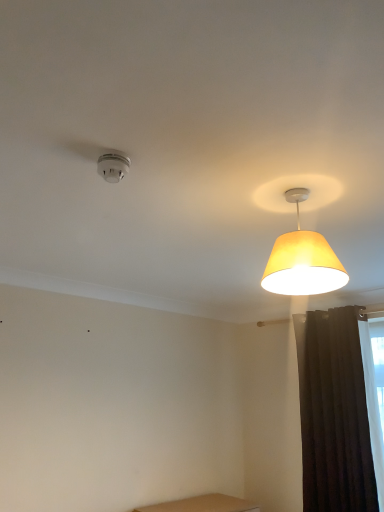
Question: In terms of height, does dark matte curtain at right look taller or shorter compared to white plastic smoke detector at upper left, the 2th lamp viewed from the right?

Choices:
 (A) short
 (B) tall

Answer: (B)

Question: From the image's perspective, is dark matte curtain at right located above or below white plastic smoke detector at upper left, the 2th lamp viewed from the right?

Choices:
 (A) above
 (B) below

Answer: (B)

Question: Estimate the real-world distances between objects in this image. Which object is closer to the white plastic smoke detector at upper left, the first lamp viewed from the left?

Choices:
 (A) yellow fabric lampshade at upper right, which appears as the 2th lamp when viewed from the left
 (B) dark matte curtain at right

Answer: (A)

Question: Estimate the real-world distances between objects in this image. Which object is closer to the white plastic smoke detector at upper left, the 2th lamp viewed from the right?

Choices:
 (A) dark matte curtain at right
 (B) yellow fabric lampshade at upper right, which appears as the 2th lamp when viewed from the left

Answer: (B)